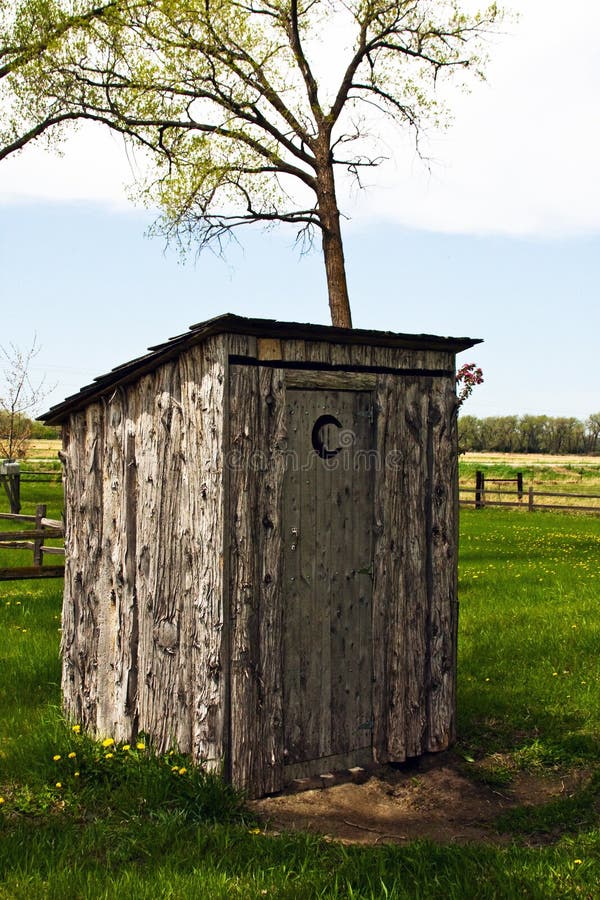
At what (x,y) coordinates should I click in order to perform the action: click on moon-shaped hold in door. Please return your answer as a coordinate pair (x, y). The width and height of the screenshot is (600, 900). Looking at the image, I should click on (326, 435).